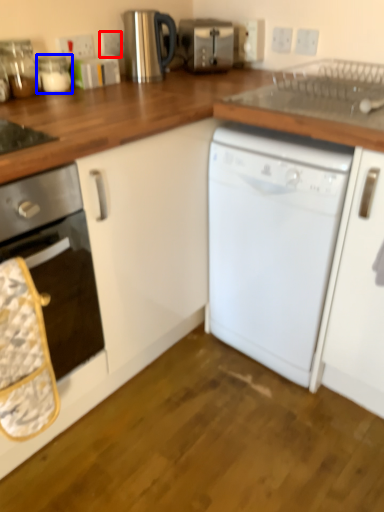
Question: Among these objects, which one is farthest to the camera, electric outlet (highlighted by a red box) or appliance (highlighted by a blue box)?

Choices:
 (A) electric outlet
 (B) appliance

Answer: (A)